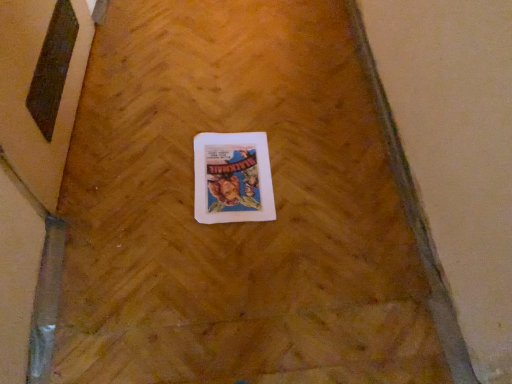
Measure the distance between matte white card at center and camera.

matte white card at center is 1.07 meters away from camera.

The height and width of the screenshot is (384, 512). What do you see at coordinates (232, 178) in the screenshot?
I see `matte white card at center` at bounding box center [232, 178].

Identify the location of matte white card at center. The height and width of the screenshot is (384, 512). (232, 178).

At what (x,y) coordinates should I click in order to perform the action: click on matte white card at center. Please return your answer as a coordinate pair (x, y). Looking at the image, I should click on (232, 178).